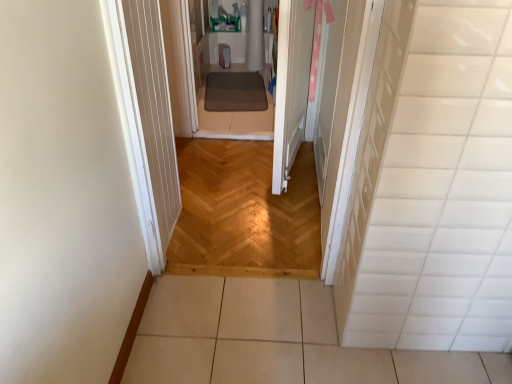
Image resolution: width=512 pixels, height=384 pixels. What are the coordinates of `white wood door at center` in the screenshot? It's located at (291, 86).

This screenshot has width=512, height=384. What do you see at coordinates (275, 339) in the screenshot?
I see `white tile floor at lower center` at bounding box center [275, 339].

This screenshot has width=512, height=384. What are the coordinates of `white glossy tile at right` in the screenshot? It's located at (433, 185).

This screenshot has width=512, height=384. I want to click on natural wood floor at center, so (x=244, y=212).

Is white tile floor at lower center wider or thinner than white wood door at center?

white tile floor at lower center is wider than white wood door at center.

From the image's perspective, between white tile floor at lower center and white wood door at center, which one is located above?

white wood door at center appears higher in the image.

Is white tile floor at lower center next to white wood door at center and touching it?

No, white tile floor at lower center is not touching white wood door at center.

How much distance is there between white wood door at center and natural wood floor at center?

white wood door at center is 16.81 inches away from natural wood floor at center.

What's the angular difference between white wood door at center and natural wood floor at center's facing directions?

white wood door at center and natural wood floor at center are facing 102 degrees away from each other.

Considering the sizes of objects white wood door at center and natural wood floor at center in the image provided, who is taller, white wood door at center or natural wood floor at center?

With more height is white wood door at center.

Is white wood door at center bigger or smaller than natural wood floor at center?

white wood door at center is bigger than natural wood floor at center.

Can you confirm if natural wood floor at center is positioned to the right of white wood door at center?

No, natural wood floor at center is not to the right of white wood door at center.

Is natural wood floor at center looking in the opposite direction of white wood door at center?

No.

In the scene shown: Is white wood door at center inside natural wood floor at center?

Definitely not — white wood door at center is not inside natural wood floor at center.

Find the location of `door in front of the natural wood floor at center`. door in front of the natural wood floor at center is located at coordinates (291, 86).

From a real-world perspective, relative to brown textured mat at center, is white wood door at center vertically above or below?

From a real-world perspective, white wood door at center is physically above brown textured mat at center.

Between point (301, 66) and point (216, 72), which one is positioned in front?

The point (301, 66) is in front.

From the image's perspective, which one is positioned higher, white wood door at center or brown textured mat at center?

brown textured mat at center, from the image's perspective.

Is white wood door at center shorter than brown textured mat at center?

In fact, white wood door at center may be taller than brown textured mat at center.

From the image's perspective, relative to brown textured mat at center, is natural wood floor at center above or below?

natural wood floor at center is situated lower than brown textured mat at center in the image.

Would you say brown textured mat at center is part of natural wood floor at center's contents?

Actually, brown textured mat at center is outside natural wood floor at center.

Does natural wood floor at center have a lesser height compared to brown textured mat at center?

No, natural wood floor at center is not shorter than brown textured mat at center.

In terms of size, does natural wood floor at center appear bigger or smaller than brown textured mat at center?

Clearly, natural wood floor at center is larger in size than brown textured mat at center.

Does point (263, 99) come behind point (188, 272)?

Yes, point (263, 99) is farther from viewer.

Between brown textured mat at center and natural wood floor at center, which one has smaller size?

brown textured mat at center.

From the image's perspective, is brown textured mat at center located above or below natural wood floor at center?

From the image's perspective, brown textured mat at center appears above natural wood floor at center.

From a real-world perspective, is brown textured mat at center located beneath natural wood floor at center?

No, from a real-world perspective, brown textured mat at center is not under natural wood floor at center.

From a real-world perspective, between brown textured mat at center and white glossy tile at right, who is vertically higher?

In real-world perspective, white glossy tile at right is above.

Considering the positions of points (216, 90) and (410, 94), is point (216, 90) farther from camera compared to point (410, 94)?

Yes, point (216, 90) is behind point (410, 94).

Could you tell me if brown textured mat at center is turned towards white glossy tile at right?

No, brown textured mat at center is not aimed at white glossy tile at right.

Considering the relative sizes of brown textured mat at center and white glossy tile at right in the image provided, is brown textured mat at center thinner than white glossy tile at right?

No, brown textured mat at center is not thinner than white glossy tile at right.

At what (x,y) coordinates should I click in order to perform the action: click on path on the right of the white wood door at center. Please return your answer as a coordinate pair (x, y). Looking at the image, I should click on (275, 339).

I want to click on door that is above the natural wood floor at center (from the image's perspective), so click(291, 86).

From the image, which object appears to be nearer to white wood door at center, brown textured mat at center or white glossy tile at right?

brown textured mat at center lies closer to white wood door at center than the other object.

Based on the photo, based on their spatial positions, is natural wood floor at center or white tile floor at lower center further from white glossy tile at right?

natural wood floor at center is positioned further to the anchor white glossy tile at right.

Estimate the real-world distances between objects in this image. Which object is further from white tile floor at lower center, brown textured mat at center or white wood door at center?

Among the two, brown textured mat at center is located further to white tile floor at lower center.

From the image, which object appears to be farther from white glossy tile at right, natural wood floor at center or white wood door at center?

white wood door at center lies further to white glossy tile at right than the other object.

Estimate the real-world distances between objects in this image. Which object is closer to brown textured mat at center, natural wood floor at center or white glossy tile at right?

natural wood floor at center is positioned closer to the anchor brown textured mat at center.

Considering their positions, is white glossy tile at right positioned closer to white wood door at center than natural wood floor at center?

natural wood floor at center lies closer to white wood door at center than the other object.

Based on their spatial positions, is white tile floor at lower center or white wood door at center closer to brown textured mat at center?

white wood door at center is closer to brown textured mat at center.

Estimate the real-world distances between objects in this image. Which object is further from white wood door at center, white tile floor at lower center or white glossy tile at right?

The object further to white wood door at center is white glossy tile at right.

This screenshot has width=512, height=384. What are the coordinates of `corridor positioned between white glossy tile at right and brown textured mat at center from near to far` in the screenshot? It's located at (244, 212).

The width and height of the screenshot is (512, 384). Find the location of `path between white glossy tile at right and brown textured mat at center in the front-back direction`. path between white glossy tile at right and brown textured mat at center in the front-back direction is located at coordinates (275, 339).

The width and height of the screenshot is (512, 384). I want to click on corridor between white wood door at center and brown textured mat at center in the front-back direction, so click(x=244, y=212).

This screenshot has height=384, width=512. I want to click on tile between white wood door at center and white tile floor at lower center from top to bottom, so click(433, 185).